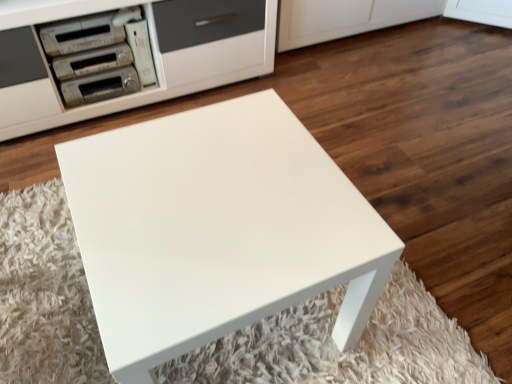
Image resolution: width=512 pixels, height=384 pixels. Find the location of `free spot to the left of white glossy table at center`. free spot to the left of white glossy table at center is located at coordinates (47, 289).